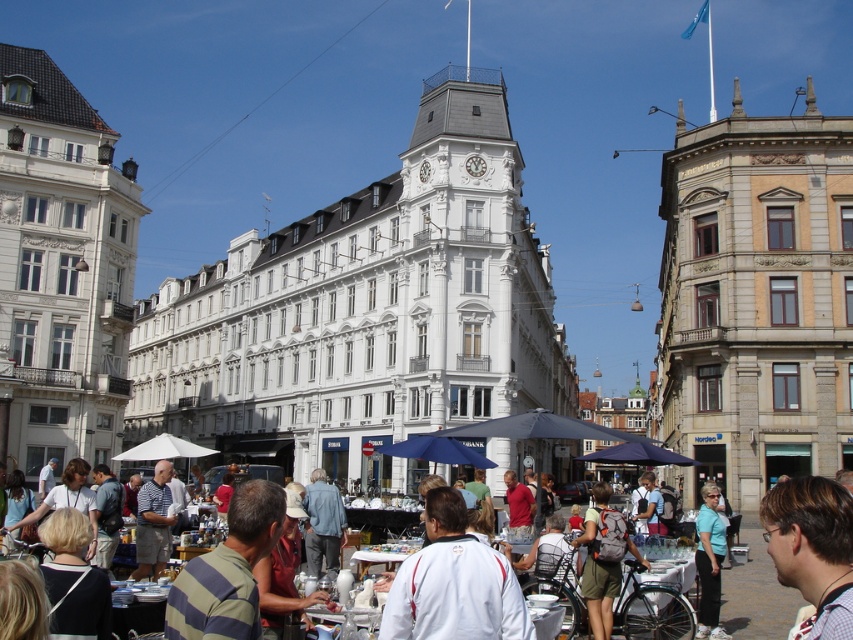
Question: Is white cotton shirt at center bigger than light blue t-shirt at center?

Choices:
 (A) yes
 (B) no

Answer: (B)

Question: Which object is closer to the camera taking this photo?

Choices:
 (A) white cotton shirt at center
 (B) light blue t-shirt at center

Answer: (A)

Question: Does white cotton shirt at center have a smaller size compared to light blue t-shirt at center?

Choices:
 (A) no
 (B) yes

Answer: (B)

Question: Does white cotton shirt at center have a lesser width compared to light blue t-shirt at center?

Choices:
 (A) yes
 (B) no

Answer: (B)